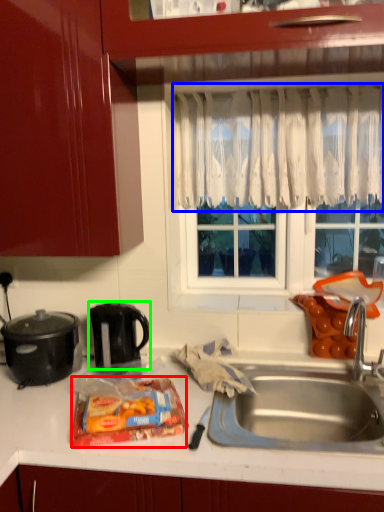
Question: Which object is positioned closest to snack (highlighted by a red box)? Select from curtain (highlighted by a blue box) and kitchen appliance (highlighted by a green box).

Choices:
 (A) curtain
 (B) kitchen appliance

Answer: (B)